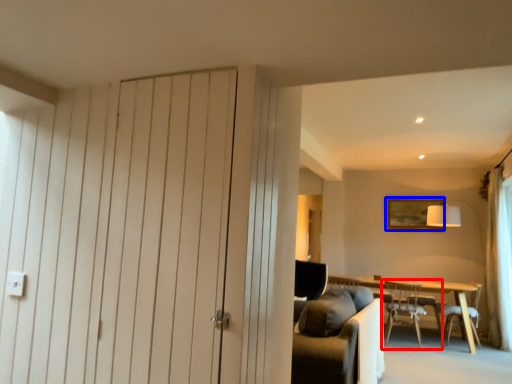
Question: Which object appears closest to the camera in this image, chair (highlighted by a red box) or picture frame (highlighted by a blue box)?

Choices:
 (A) chair
 (B) picture frame

Answer: (A)